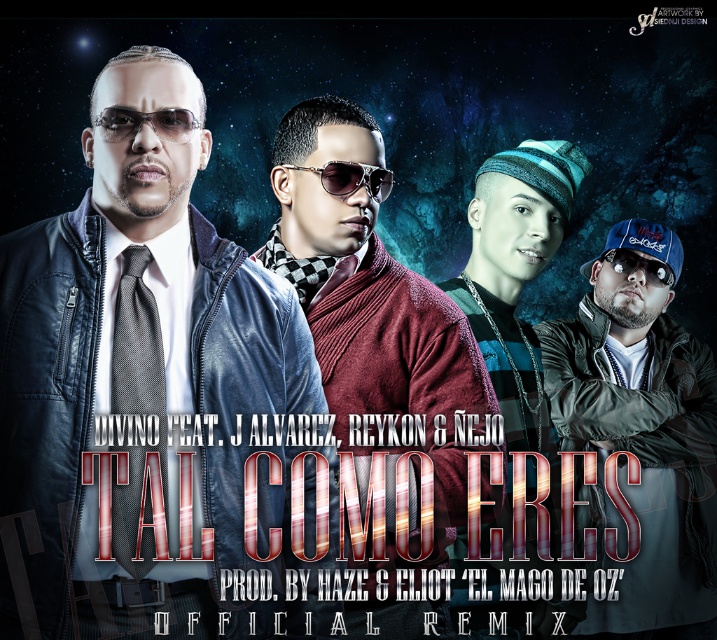
Where is `green matte jacket at center`? green matte jacket at center is located at coordinates (641, 440).

Between point (640, 573) and point (574, 145), which one is positioned behind?

The point (640, 573) is more distant.

Where is `green matte jacket at center`? This screenshot has height=640, width=717. green matte jacket at center is located at coordinates (641, 440).

How far apart are maroon sweater at center and sunglasses at center?

maroon sweater at center is 30.49 inches from sunglasses at center.

Is point (442, 604) less distant than point (191, 131)?

No, (442, 604) is further to viewer.

Who is more distant from viewer, (366, 451) or (189, 131)?

The point (366, 451) is more distant.

Find the location of `maroon sweater at center`. maroon sweater at center is located at coordinates (374, 342).

Which is more to the left, sunglasses at center or black plastic goggles at center?

Positioned to the left is sunglasses at center.

Does sunglasses at center appear under black plastic goggles at center?

Actually, sunglasses at center is above black plastic goggles at center.

Is point (123, 128) closer to camera compared to point (607, 250)?

Yes, point (123, 128) is in front of point (607, 250).

Where is `sunglasses at center`? The image size is (717, 640). sunglasses at center is located at coordinates (146, 122).